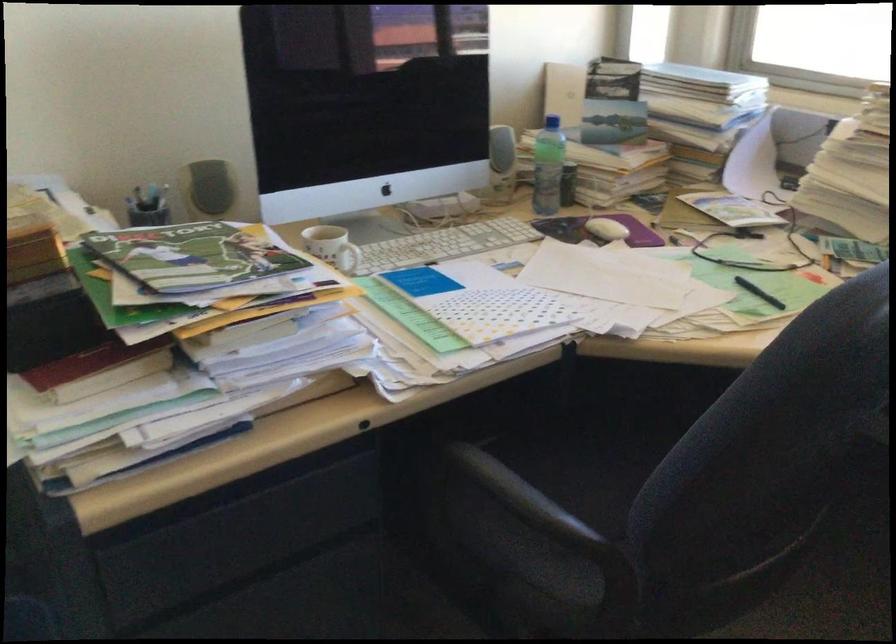
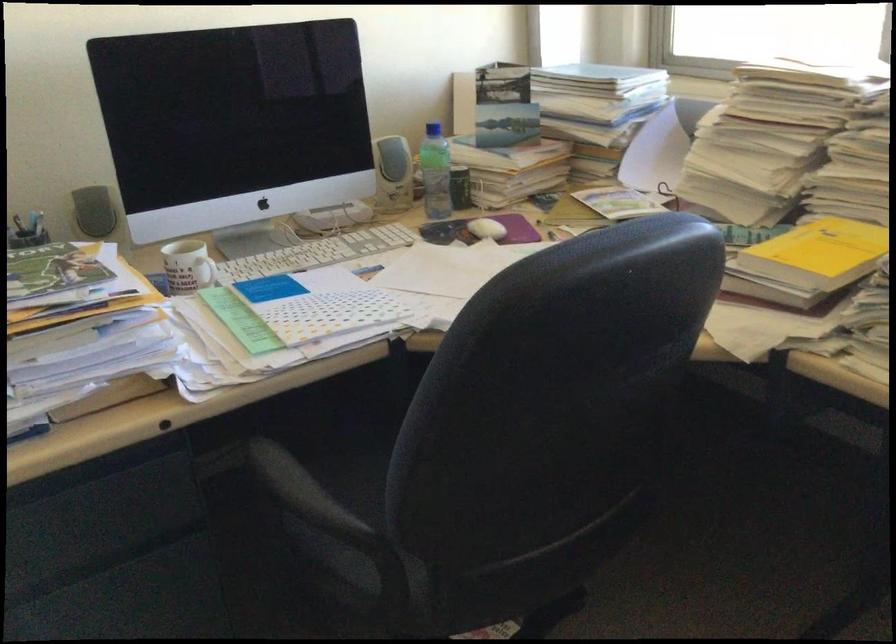
Question: I am providing you with two images of the same scene from different viewpoints. After the viewpoint changes to image2, which objects are now occluded?

Choices:
 (A) white mug handle
 (B) chair sitting surface
 (C) white standing fan
 (D) black pen

Answer: (D)